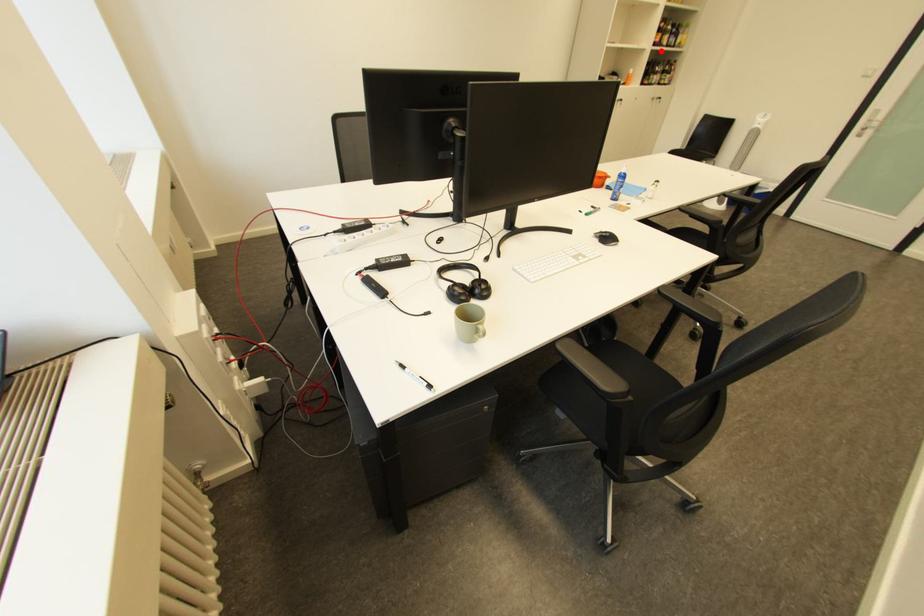
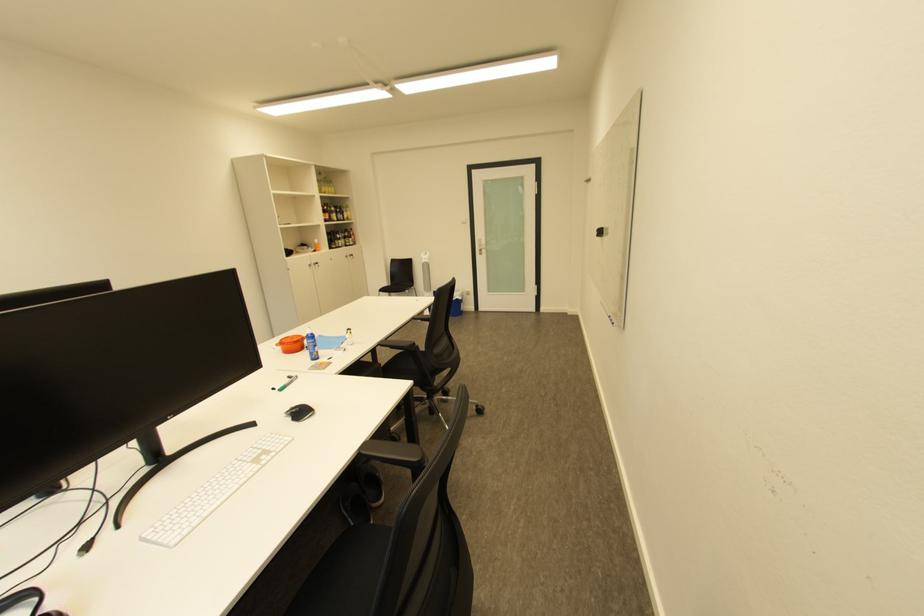
In the second image, find the point that corresponds to the highlighted location in the first image.

(335, 225)